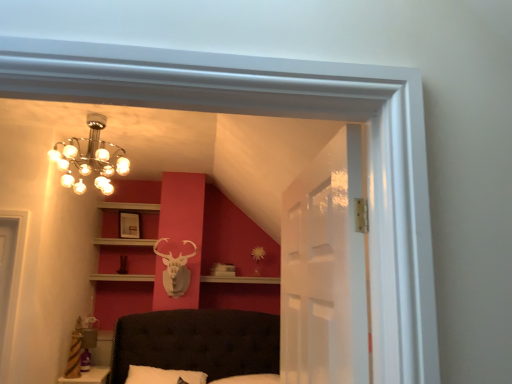
Question: Does metallic chandelier at upper left have a lesser height compared to matte white picture frame at upper center?

Choices:
 (A) yes
 (B) no

Answer: (B)

Question: Considering the relative sizes of metallic chandelier at upper left and matte white picture frame at upper center in the image provided, is metallic chandelier at upper left bigger than matte white picture frame at upper center?

Choices:
 (A) yes
 (B) no

Answer: (A)

Question: From the image's perspective, would you say metallic chandelier at upper left is shown under matte white picture frame at upper center?

Choices:
 (A) no
 (B) yes

Answer: (A)

Question: Is metallic chandelier at upper left taller than matte white picture frame at upper center?

Choices:
 (A) yes
 (B) no

Answer: (A)

Question: Is metallic chandelier at upper left facing away from matte white picture frame at upper center?

Choices:
 (A) no
 (B) yes

Answer: (B)

Question: From the image's perspective, is transparent glass door at center positioned above or below matte white picture frame at upper center?

Choices:
 (A) above
 (B) below

Answer: (A)

Question: From a real-world perspective, is transparent glass door at center above or below matte white picture frame at upper center?

Choices:
 (A) above
 (B) below

Answer: (B)

Question: Is transparent glass door at center spatially inside matte white picture frame at upper center, or outside of it?

Choices:
 (A) inside
 (B) outside

Answer: (B)

Question: Considering the positions of transparent glass door at center and matte white picture frame at upper center in the image, is transparent glass door at center bigger or smaller than matte white picture frame at upper center?

Choices:
 (A) small
 (B) big

Answer: (B)

Question: Is matte white picture frame at upper center inside or outside of metallic chandelier at upper left?

Choices:
 (A) outside
 (B) inside

Answer: (A)

Question: From a real-world perspective, is matte white picture frame at upper center physically located above or below metallic chandelier at upper left?

Choices:
 (A) above
 (B) below

Answer: (B)

Question: From their relative heights in the image, would you say matte white picture frame at upper center is taller or shorter than metallic chandelier at upper left?

Choices:
 (A) tall
 (B) short

Answer: (B)

Question: From the image's perspective, relative to metallic chandelier at upper left, is matte white picture frame at upper center above or below?

Choices:
 (A) below
 (B) above

Answer: (A)

Question: Is point (60, 142) positioned closer to the camera than point (125, 213)?

Choices:
 (A) farther
 (B) closer

Answer: (B)

Question: Is metallic chandelier at upper left in front of or behind matte white picture frame at upper center in the image?

Choices:
 (A) behind
 (B) front

Answer: (B)